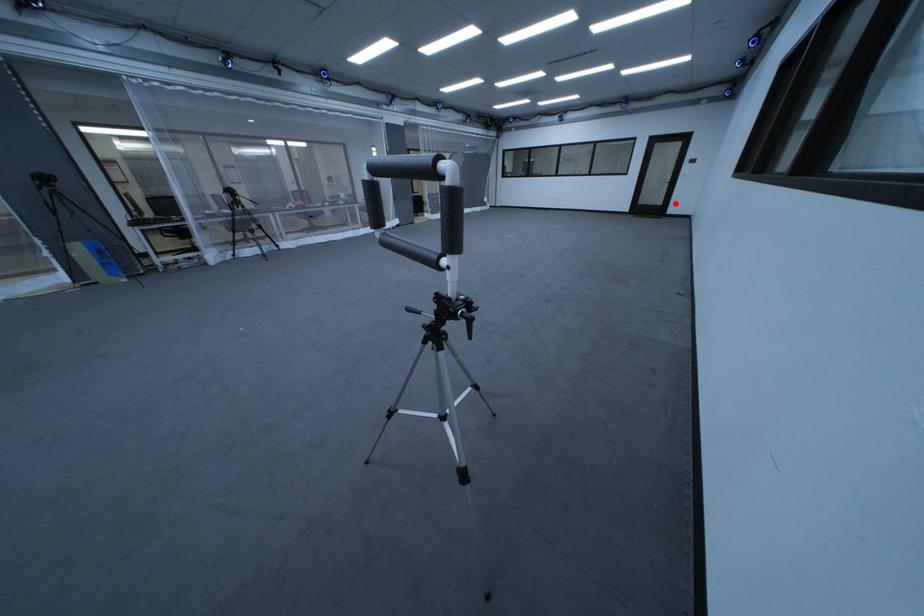
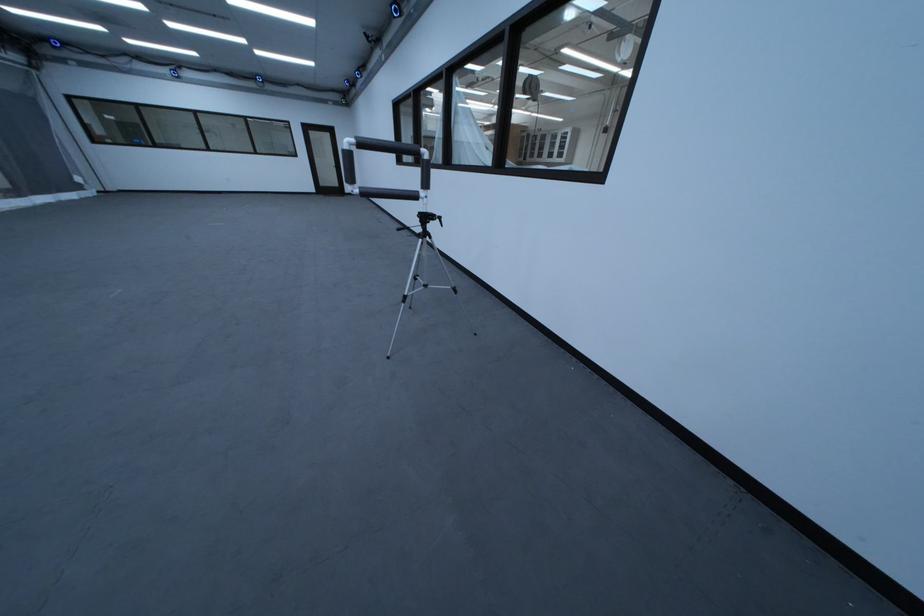
The point at the highlighted location is marked in the first image. Where is the corresponding point in the second image?

(351, 185)